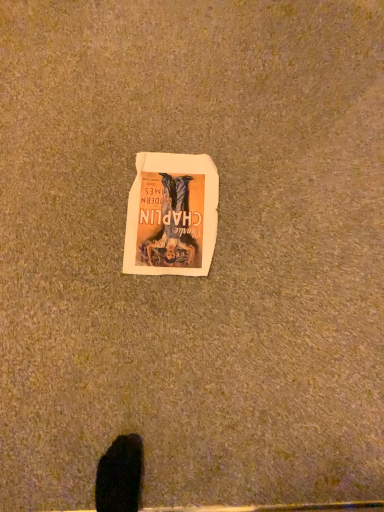
Locate an element on the screen. The height and width of the screenshot is (512, 384). free region under matte paper poster at center (from a real-world perspective) is located at coordinates (165, 212).